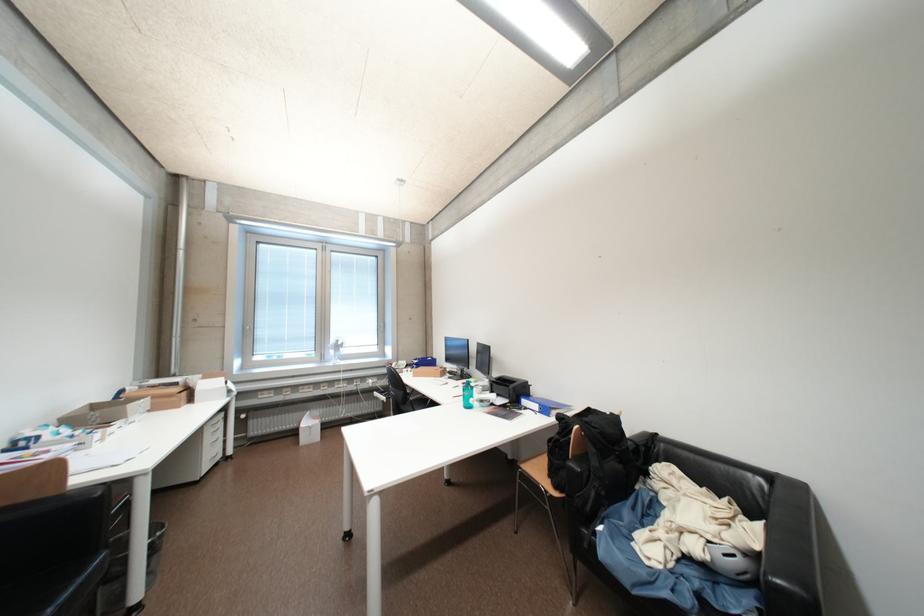
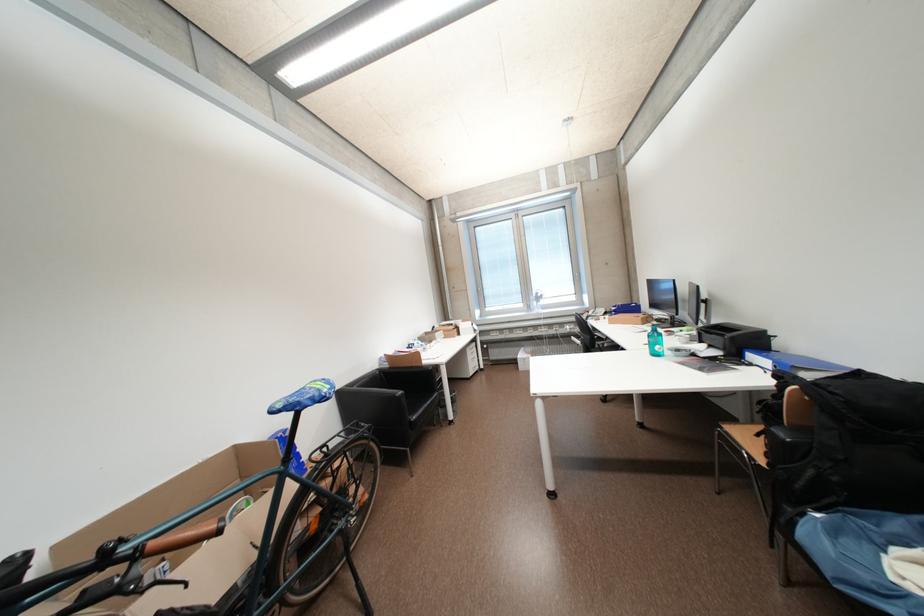
The point at (34, 499) is marked in the first image. Where is the corresponding point in the second image?

(421, 367)